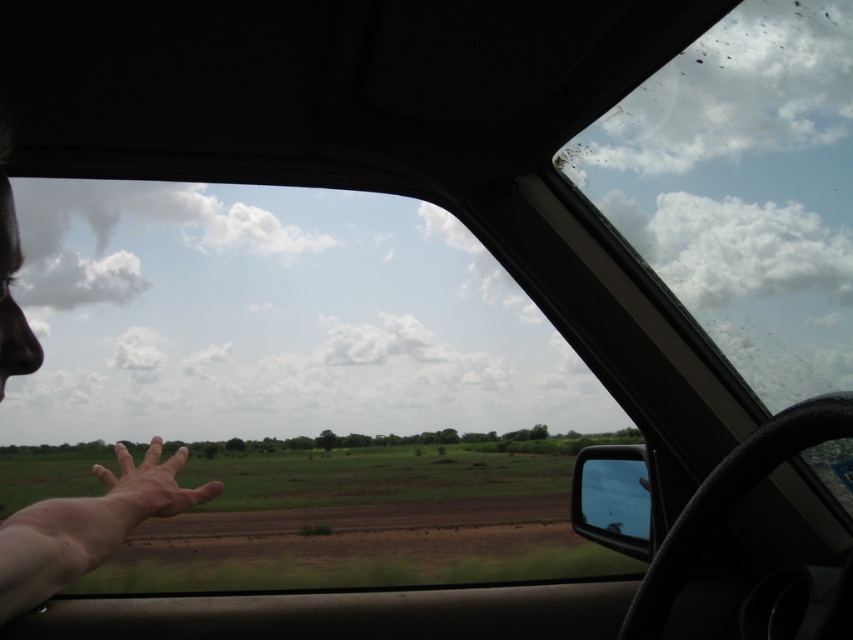
Question: Does transparent glass windshield at upper right appear on the right side of skinny flesh hand at lower left?

Choices:
 (A) yes
 (B) no

Answer: (A)

Question: Which point is farther from the camera taking this photo?

Choices:
 (A) (821, 250)
 (B) (146, 452)

Answer: (A)

Question: Is transparent glass windshield at upper right smaller than skinny flesh hand at lower left?

Choices:
 (A) yes
 (B) no

Answer: (B)

Question: Does transparent glass windshield at upper right have a greater width compared to skinny flesh hand at lower left?

Choices:
 (A) yes
 (B) no

Answer: (A)

Question: Which object appears farthest from the camera in this image?

Choices:
 (A) transparent glass windshield at upper right
 (B) skinny flesh hand at lower left

Answer: (A)

Question: Which point is farther to the camera?

Choices:
 (A) (154, 484)
 (B) (844, 8)

Answer: (B)